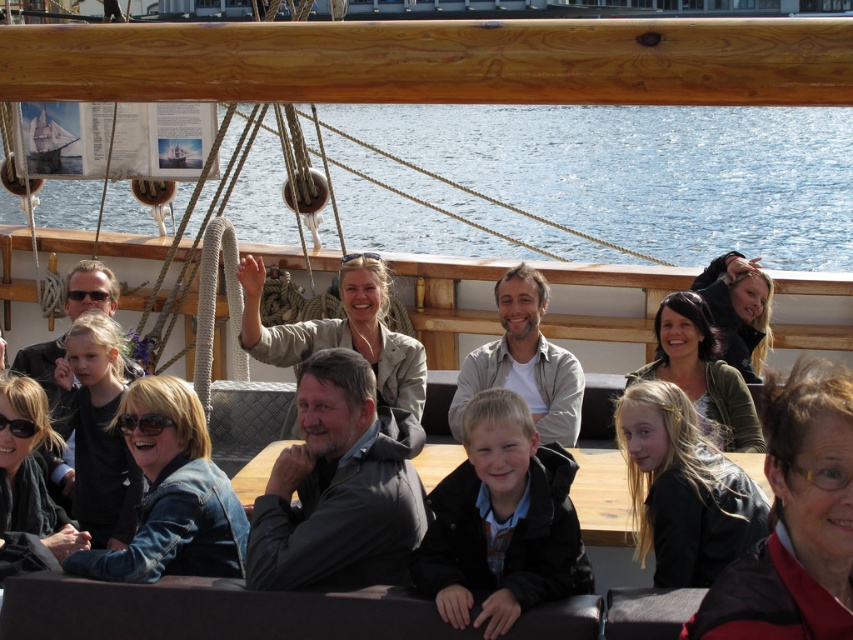
You are a photographer trying to capture a photo of the dark gray jacket at center and the denim jacket at lower left. Since you want to ensure both jackets are clearly visible, which jacket should you focus on first to avoid blurring due to their size difference?

The dark gray jacket at center is bigger than the denim jacket at lower left, so you should focus on the dark gray jacket at center first to ensure it is in sharp focus before adjusting for the smaller denim jacket at lower left.

Looking at this image, you are a photographer trying to capture a photo of the blue water at upper center and the light brown hair at center. Which object in the scene is larger in size?

A: The blue water at upper center is bigger than the light brown hair at center.